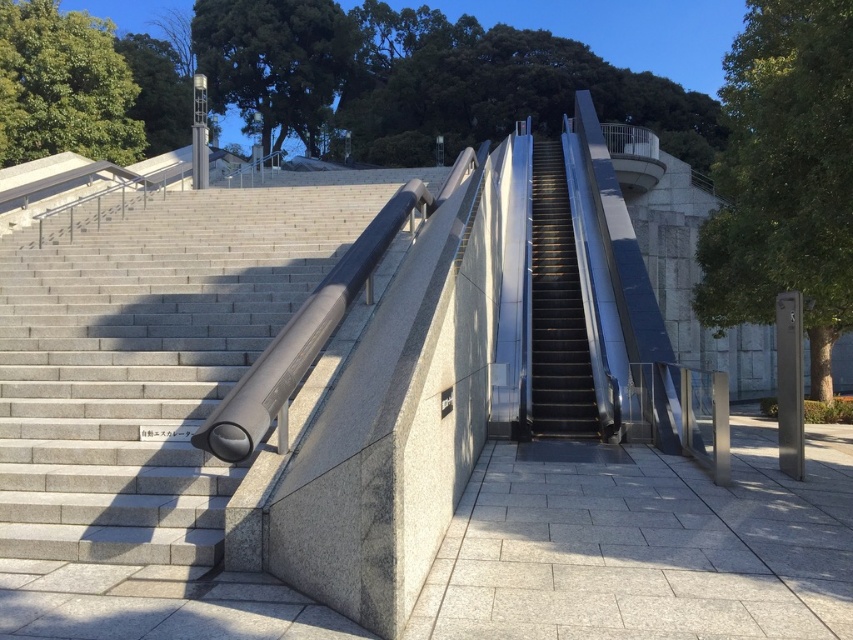
Question: Which of the following is the closest to the observer?

Choices:
 (A) (589, 380)
 (B) (80, 509)

Answer: (B)

Question: Which object appears closest to the camera in this image?

Choices:
 (A) black metal escalator at center
 (B) gray concrete stairs at left

Answer: (B)

Question: Is the position of gray concrete stairs at left less distant than that of black metal escalator at center?

Choices:
 (A) no
 (B) yes

Answer: (B)

Question: Is gray concrete stairs at left below black metal escalator at center?

Choices:
 (A) yes
 (B) no

Answer: (A)

Question: Is gray concrete stairs at left smaller than black metal escalator at center?

Choices:
 (A) yes
 (B) no

Answer: (A)